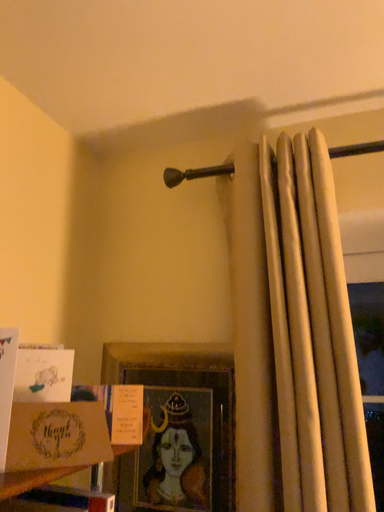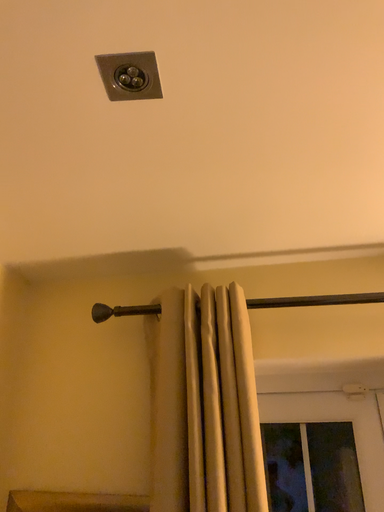
Question: Which way did the camera rotate in the video?

Choices:
 (A) rotated left
 (B) rotated right

Answer: (B)